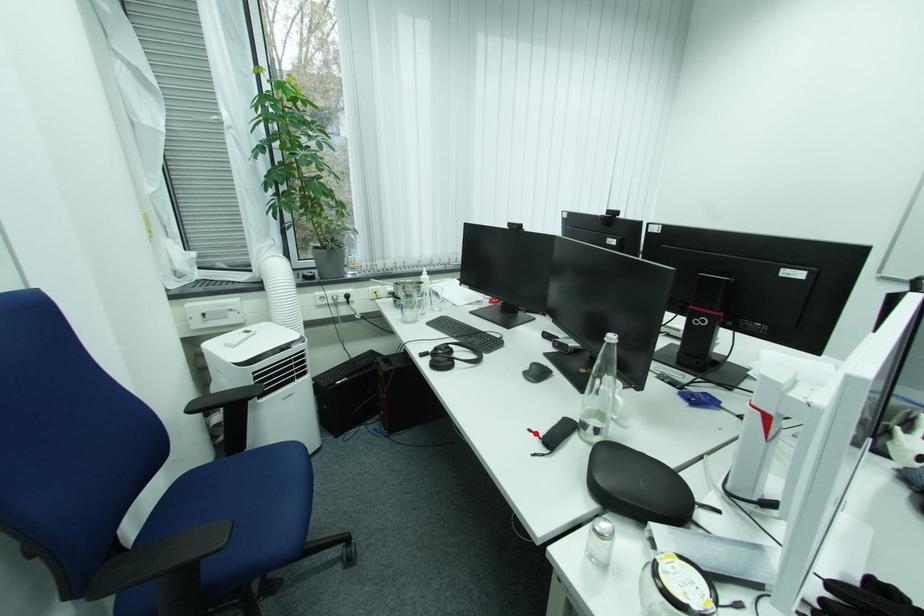
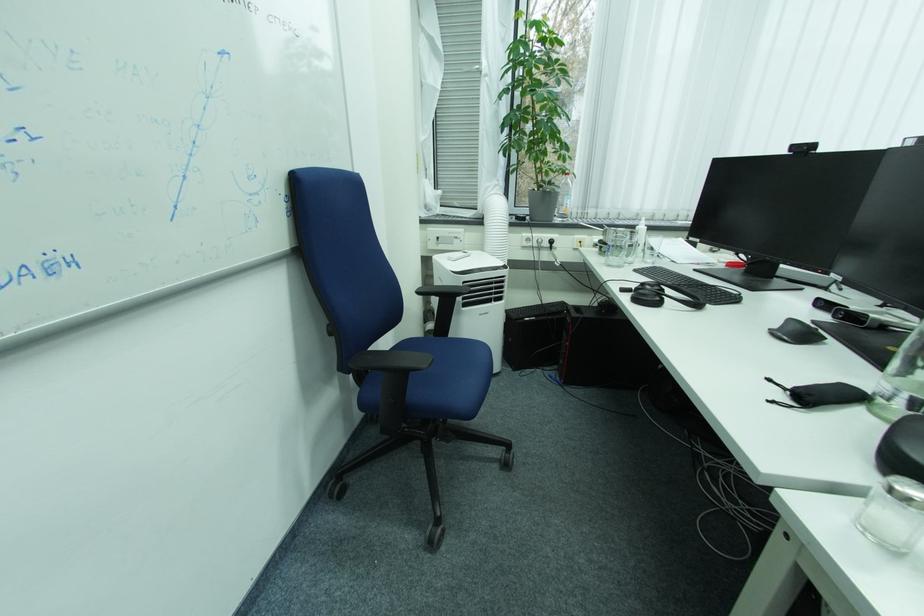
Locate, in the second image, the point that corresponds to the highlighted location in the first image.

(773, 383)